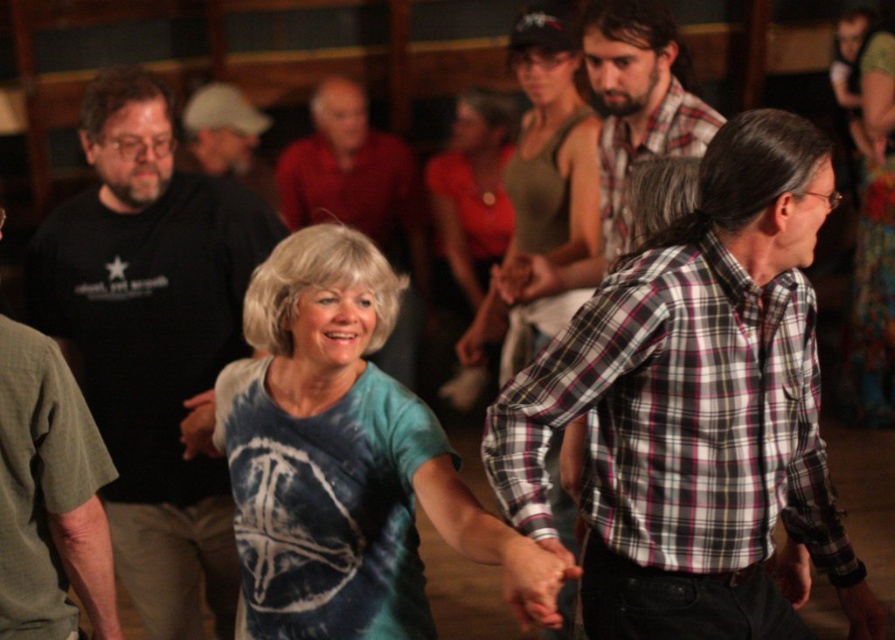
In the image, there is a point at coordinates (696,408). Which object from the list below is located at this point? Choose between the woman on the left and the man in the plaid shirt at right.

The point at coordinates (696,408) corresponds to the plaid shirt at right.

You are standing at the entrance of the dance hall and see two points in the image. The first point is at coordinates point (691, 612) and the second is at point (416, 435). Which point is closer to you?

Point (691, 612) is closer to the viewer than point (416, 435).

You are at a dance event and want to know which of the two shirts, the plaid shirt at right or the matte red shirt at center, is wider. Based on the scene description, can you determine which one is wider?

The plaid shirt at right is wider than the matte red shirt at center according to the description.